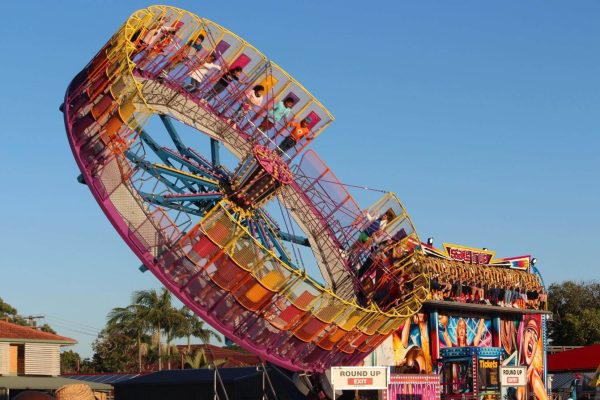
Locate an element on the screen. lights is located at coordinates (534, 259), (430, 238).